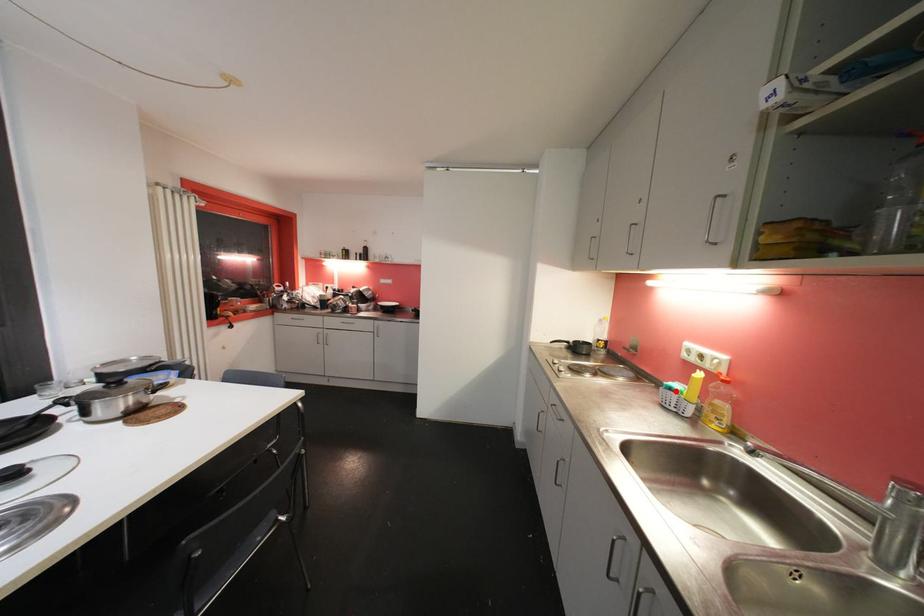
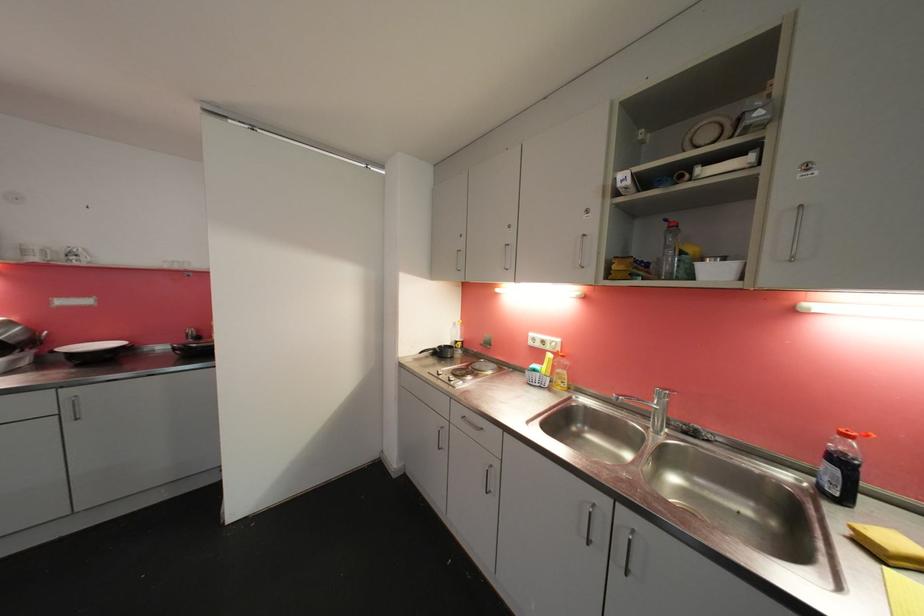
Where in the second image is the point corresponding to the highlighted location from the first image?

(540, 373)